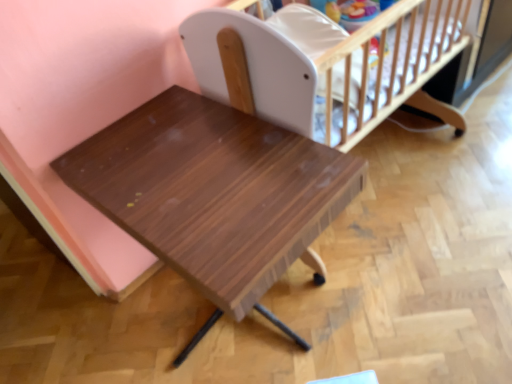
Question: Relative to wooden table at center, is white matte infant bed at upper center in front or behind?

Choices:
 (A) behind
 (B) front

Answer: (A)

Question: Do you think white matte infant bed at upper center is within wooden table at center, or outside of it?

Choices:
 (A) outside
 (B) inside

Answer: (A)

Question: From a real-world perspective, relative to wooden table at center, is white matte infant bed at upper center vertically above or below?

Choices:
 (A) below
 (B) above

Answer: (B)

Question: In terms of height, does wooden table at center look taller or shorter compared to white matte infant bed at upper center?

Choices:
 (A) short
 (B) tall

Answer: (B)

Question: From the image's perspective, is wooden table at center positioned above or below white matte infant bed at upper center?

Choices:
 (A) above
 (B) below

Answer: (B)

Question: From a real-world perspective, is wooden table at center physically located above or below white matte infant bed at upper center?

Choices:
 (A) below
 (B) above

Answer: (A)

Question: Looking at the image, does wooden table at center seem bigger or smaller compared to white matte infant bed at upper center?

Choices:
 (A) big
 (B) small

Answer: (A)